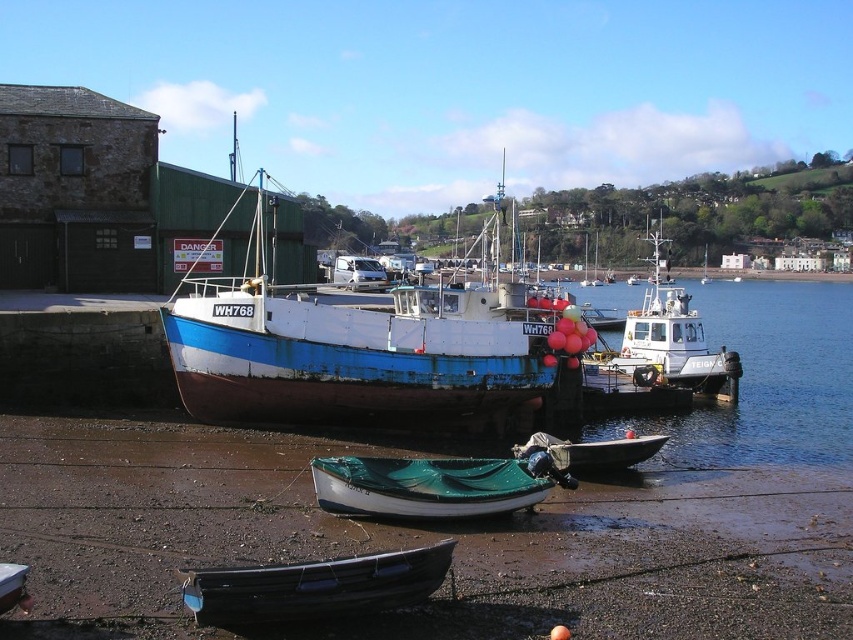
Does black plastic boat at lower center appear under white matte tugboat at center-right?

Yes.

Who is more forward, (247, 592) or (695, 323)?

Positioned in front is point (247, 592).

Locate an element on the screen. black plastic boat at lower center is located at coordinates (314, 586).

Is point (392, 557) positioned in front of point (346, 470)?

Yes, it is.

How distant is black plastic boat at lower center from green tarpaulin boat at lower center?

black plastic boat at lower center and green tarpaulin boat at lower center are 3.55 meters apart from each other.

Find the location of a particular element. Image resolution: width=853 pixels, height=640 pixels. black plastic boat at lower center is located at coordinates (314, 586).

The image size is (853, 640). Identify the location of black plastic boat at lower center. (314, 586).

Between point (428, 513) and point (712, 355), which one is positioned behind?

The point (712, 355) is behind.

Does green tarpaulin boat at lower center appear under white matte tugboat at center-right?

Yes, green tarpaulin boat at lower center is below white matte tugboat at center-right.

Is point (315, 476) farther from viewer compared to point (619, 353)?

No, it is not.

Identify the location of green tarpaulin boat at lower center. pyautogui.click(x=425, y=486).